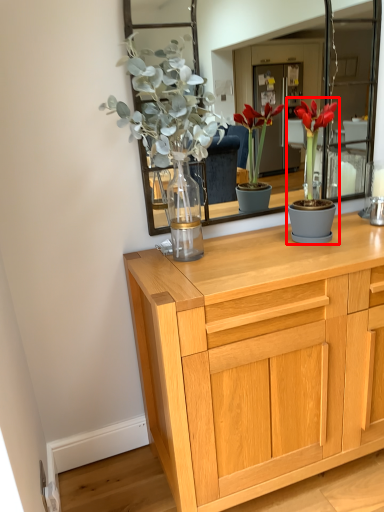
Question: From the image's perspective, where is houseplant (annotated by the red box) located in relation to chest of drawers in the image?

Choices:
 (A) below
 (B) above

Answer: (B)